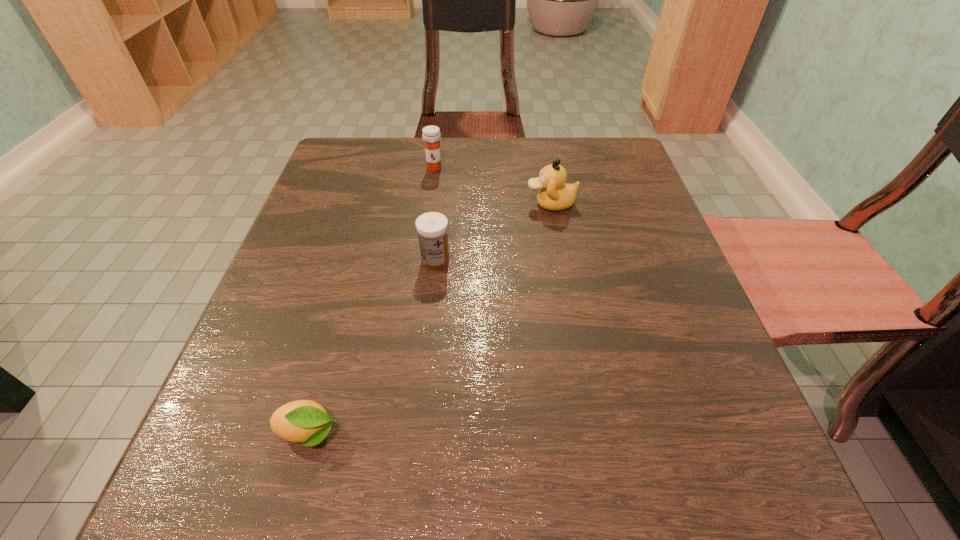
The width and height of the screenshot is (960, 540). In order to click on vacant space at the right edge of the desktop in this screenshot , I will do `click(636, 215)`.

Image resolution: width=960 pixels, height=540 pixels. In order to click on blank area at the far left corner in this screenshot , I will do `click(398, 148)`.

The width and height of the screenshot is (960, 540). Identify the location of vacant area at the near left corner. (244, 469).

Locate an element on the screen. The image size is (960, 540). vacant region at the far right corner of the desktop is located at coordinates (616, 186).

I want to click on vacant space at the near right corner of the desktop, so click(x=642, y=454).

Find the location of `vacant point located between the nearest object and the farther medicine`. vacant point located between the nearest object and the farther medicine is located at coordinates (372, 301).

The image size is (960, 540). In order to click on empty space between the second farthest object and the third farthest object in this screenshot , I will do `click(493, 232)`.

Locate an element on the screen. free point between the lemon and the farther medicine is located at coordinates (372, 301).

Locate an element on the screen. Image resolution: width=960 pixels, height=540 pixels. empty space between the farther medicine and the lemon is located at coordinates (372, 301).

Find the location of a particular element. This screenshot has height=540, width=960. empty space between the leftmost object and the farthest object is located at coordinates (372, 301).